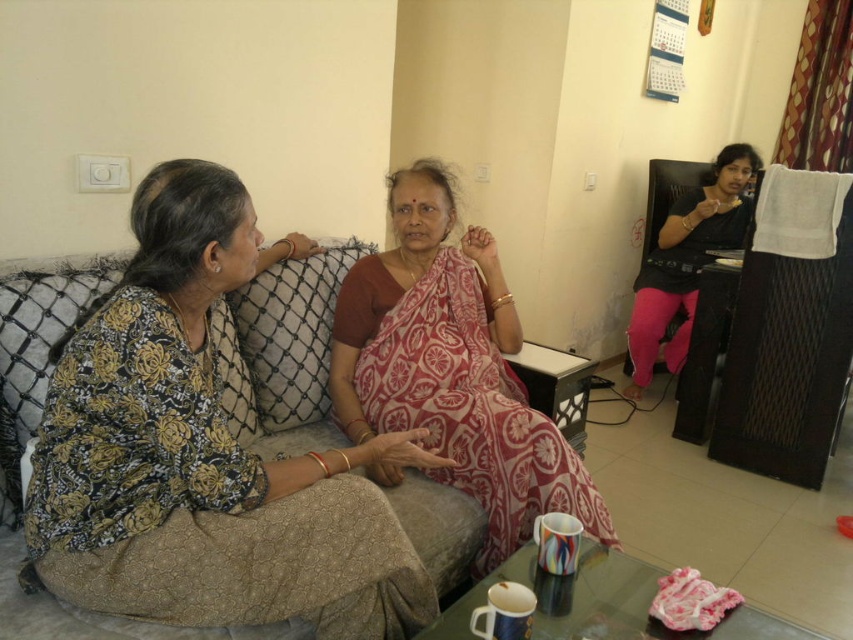
You are a tailor measuring the space between the red floral saree at center and the beige fabric couch at center for a new piece of furniture. The furniture is 32 inches wide. Will it fit between them?

The distance between the red floral saree at center and the beige fabric couch at center is 30.20 inches. Since the furniture is 32 inches wide, it will not fit as it is 1.8 inches too wide.

You are standing in the living room and want to place a small plant exactly at the point marked by coordinates point [451,369]. However, you notice that the area around this point is occupied by the red floral saree at center. Can you confirm if placing the plant at this point would be possible without overlapping the saree?

The point [451,369] is on red floral saree at center, so placing the plant there would overlap with the saree, making it impossible.